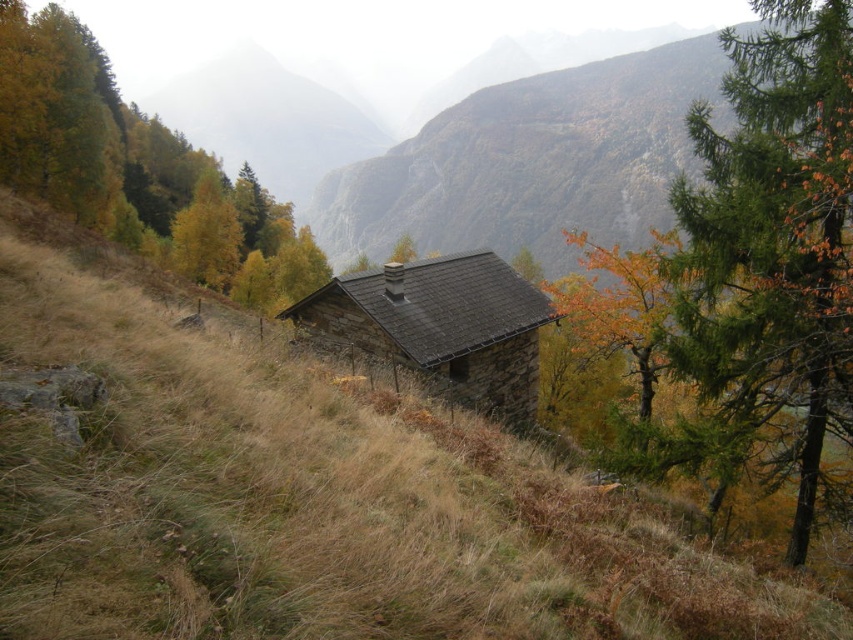
Question: Is brown grassy at center above green matte tree at center?

Choices:
 (A) no
 (B) yes

Answer: (A)

Question: Estimate the real-world distances between objects in this image. Which object is closer to the brown stone hut at center?

Choices:
 (A) brown grassy at center
 (B) green matte tree at center

Answer: (A)

Question: Which point is farther to the camera?

Choices:
 (A) brown grassy at center
 (B) green matte tree at center

Answer: (B)

Question: Does brown grassy at center appear under green matte tree at center?

Choices:
 (A) no
 (B) yes

Answer: (B)

Question: Can you confirm if brown grassy at center is positioned to the right of brown stone hut at center?

Choices:
 (A) no
 (B) yes

Answer: (A)

Question: Which of the following is the closest to the observer?

Choices:
 (A) (486, 378)
 (B) (281, 570)
 (C) (4, 176)

Answer: (B)